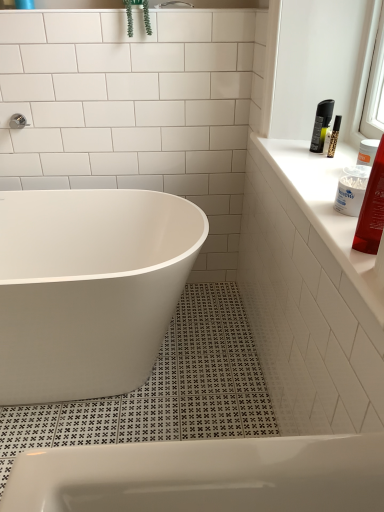
Question: Can you confirm if white glossy bathtub at center is thinner than shiny red plastic tube at upper right?

Choices:
 (A) yes
 (B) no

Answer: (B)

Question: Can you confirm if white glossy bathtub at center is positioned to the right of shiny red plastic tube at upper right?

Choices:
 (A) yes
 (B) no

Answer: (B)

Question: From a real-world perspective, is white glossy bathtub at center located beneath shiny red plastic tube at upper right?

Choices:
 (A) no
 (B) yes

Answer: (B)

Question: Could you tell me if white glossy bathtub at center is facing shiny red plastic tube at upper right?

Choices:
 (A) no
 (B) yes

Answer: (A)

Question: From the image's perspective, is white glossy bathtub at center under shiny red plastic tube at upper right?

Choices:
 (A) yes
 (B) no

Answer: (A)

Question: Is white glossy bathtub at center behind shiny red plastic tube at upper right?

Choices:
 (A) yes
 (B) no

Answer: (A)

Question: Considering the relative sizes of white glossy countertop at upper right and shiny red plastic tube at upper right in the image provided, is white glossy countertop at upper right shorter than shiny red plastic tube at upper right?

Choices:
 (A) no
 (B) yes

Answer: (B)

Question: From the image's perspective, is white glossy countertop at upper right located above shiny red plastic tube at upper right?

Choices:
 (A) no
 (B) yes

Answer: (B)

Question: Can you confirm if white glossy countertop at upper right is smaller than shiny red plastic tube at upper right?

Choices:
 (A) no
 (B) yes

Answer: (A)

Question: Does white glossy countertop at upper right appear on the left side of shiny red plastic tube at upper right?

Choices:
 (A) yes
 (B) no

Answer: (B)

Question: Is shiny red plastic tube at upper right at the back of white glossy countertop at upper right?

Choices:
 (A) no
 (B) yes

Answer: (A)

Question: Can shiny red plastic tube at upper right be found inside white glossy countertop at upper right?

Choices:
 (A) no
 (B) yes

Answer: (A)

Question: Considering the relative positions of green leafy plant at upper center and shiny red plastic tube at upper right in the image provided, is green leafy plant at upper center behind shiny red plastic tube at upper right?

Choices:
 (A) yes
 (B) no

Answer: (A)